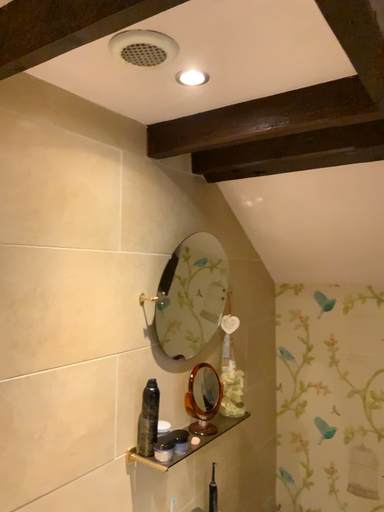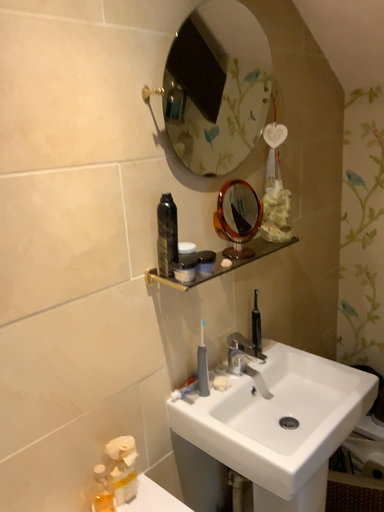
Question: Which way did the camera rotate in the video?

Choices:
 (A) rotated left
 (B) rotated right

Answer: (A)